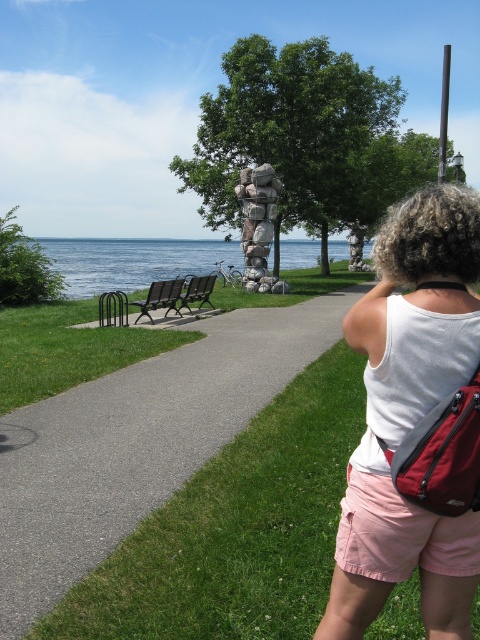
Question: Where is pink cotton shorts at lower right located in relation to black plastic bench at left in the image?

Choices:
 (A) right
 (B) left

Answer: (A)

Question: Is gray asphalt path at center wider than black plastic bench at left?

Choices:
 (A) yes
 (B) no

Answer: (A)

Question: Considering the real-world distances, which object is farthest from the black plastic bench at left?

Choices:
 (A) pink cotton shorts at lower right
 (B) white fabric tank top at upper right
 (C) gray asphalt path at center
 (D) blue water at center

Answer: (D)

Question: Which object is positioned closest to the black plastic bench at left?

Choices:
 (A) gray asphalt path at center
 (B) white fabric tank top at upper right
 (C) blue water at center

Answer: (A)

Question: Does green grass at lower left have a larger size compared to blue water at center?

Choices:
 (A) yes
 (B) no

Answer: (B)

Question: Estimate the real-world distances between objects in this image. Which object is closer to the blue water at center?

Choices:
 (A) gray asphalt path at center
 (B) black plastic bench at left

Answer: (A)